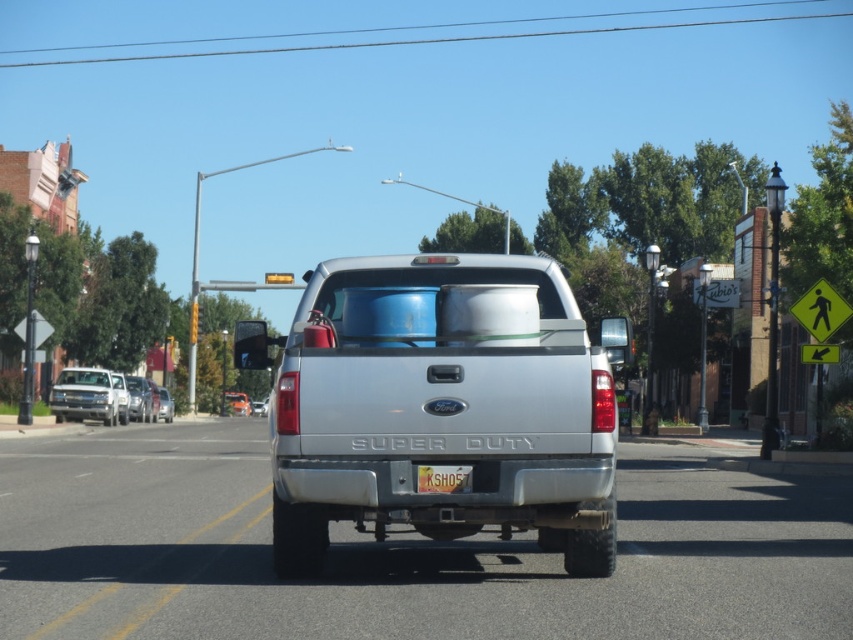
Does yellow matte license plate at center have a greater width compared to silver metallic sedan at center?

In fact, yellow matte license plate at center might be narrower than silver metallic sedan at center.

Can you confirm if yellow matte license plate at center is thinner than silver metallic sedan at center?

Yes, yellow matte license plate at center is thinner than silver metallic sedan at center.

Who is more forward, [418,467] or [167,394]?

Positioned in front is point [418,467].

In order to click on yellow matte license plate at center in this screenshot , I will do `click(444, 477)`.

You are a GUI agent. You are given a task and a screenshot of the screen. Output one action in this format:
    pyautogui.click(x=<x>, y=<y>)
    Task: Click on the satin silver sedan at center
    
    Given the screenshot: What is the action you would take?
    pyautogui.click(x=142, y=397)

Who is taller, satin silver sedan at center or metallic silver truck at center?

metallic silver truck at center

Which is behind, point (132, 419) or point (228, 410)?

The point (228, 410) is more distant.

Find the location of a particular element. The width and height of the screenshot is (853, 640). satin silver sedan at center is located at coordinates (142, 397).

Does silver metallic truck at left have a larger size compared to silver metallic sedan at center?

Actually, silver metallic truck at left might be smaller than silver metallic sedan at center.

Between silver metallic truck at left and silver metallic sedan at center, which one is positioned lower?

silver metallic sedan at center

Identify the location of silver metallic truck at left. (88, 396).